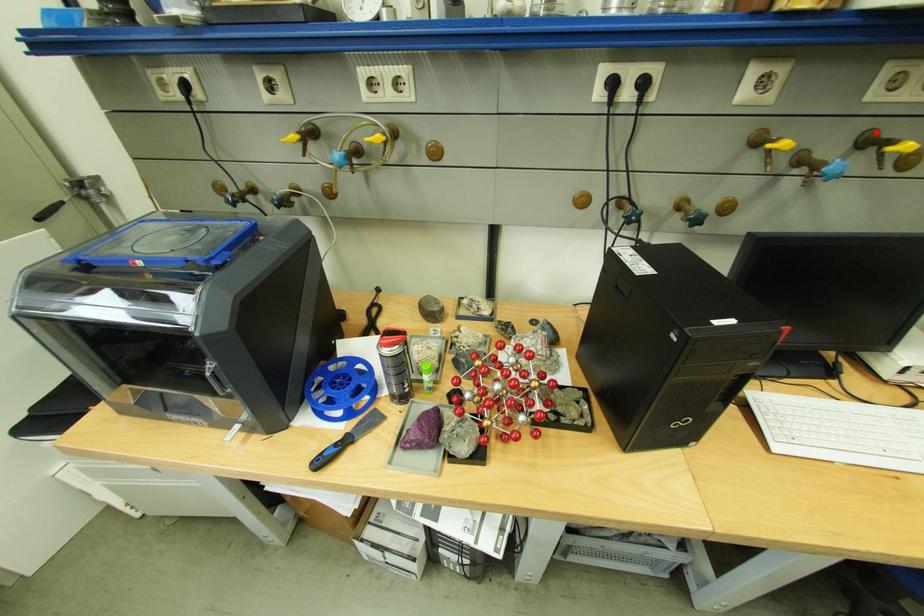
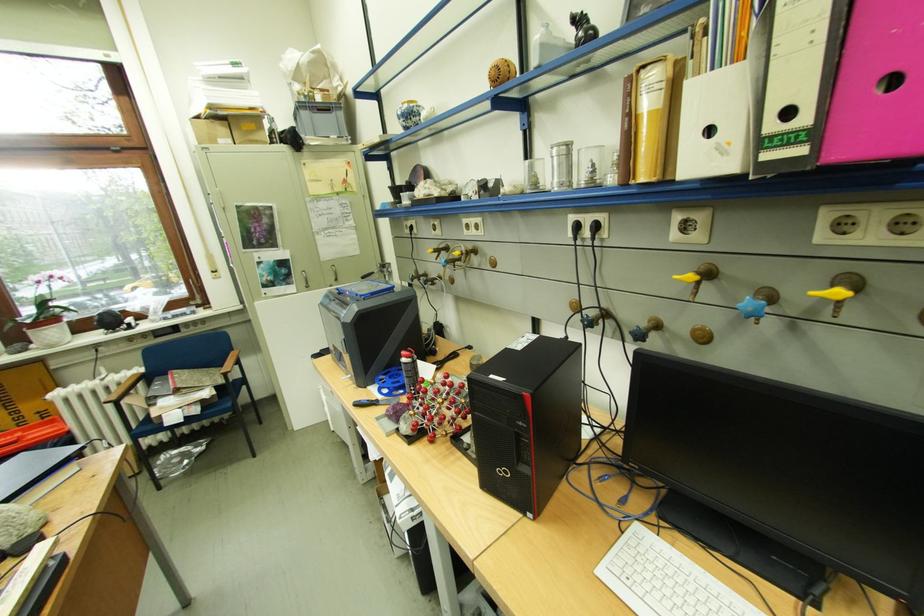
Where in the second image is the point corresponding to the highlighted location from the first image?

(852, 275)